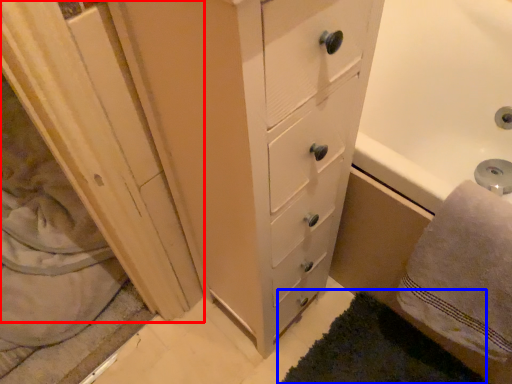
Question: Among these objects, which one is nearest to the camera, screen door (highlighted by a red box) or bath mat (highlighted by a blue box)?

Choices:
 (A) screen door
 (B) bath mat

Answer: (B)